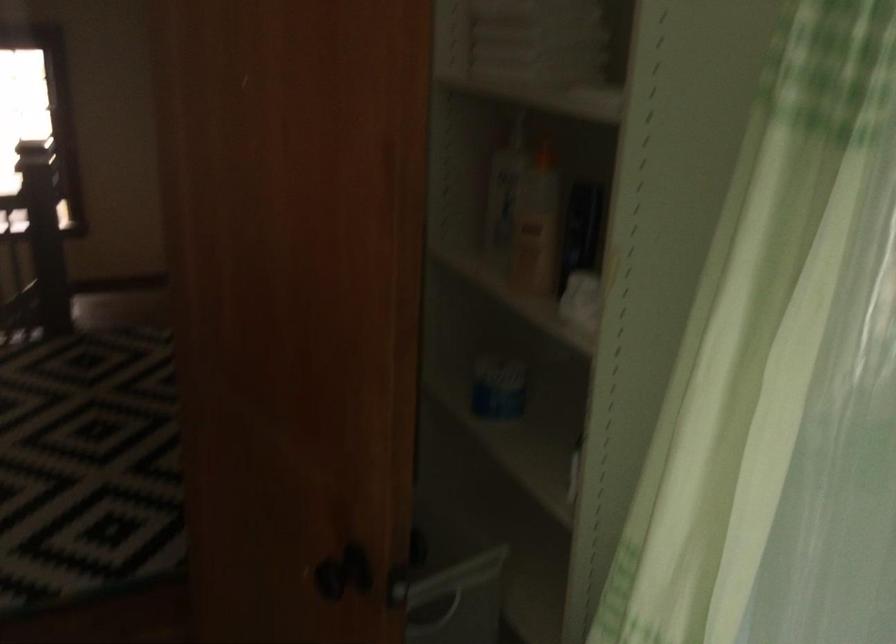
This screenshot has height=644, width=896. What are the coordinates of `bottle pump top` in the screenshot? It's located at (539, 142).